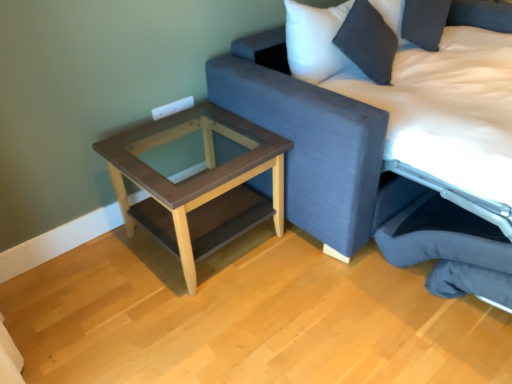
Question: Considering the relative positions of textured fabric studio couch at upper right and dark gray fabric swivel chair at lower right in the image provided, is textured fabric studio couch at upper right to the right of dark gray fabric swivel chair at lower right from the viewer's perspective?

Choices:
 (A) yes
 (B) no

Answer: (A)

Question: Is textured fabric studio couch at upper right oriented away from dark gray fabric swivel chair at lower right?

Choices:
 (A) yes
 (B) no

Answer: (B)

Question: Is textured fabric studio couch at upper right in front of dark gray fabric swivel chair at lower right?

Choices:
 (A) yes
 (B) no

Answer: (A)

Question: From the image's perspective, does textured fabric studio couch at upper right appear higher than dark gray fabric swivel chair at lower right?

Choices:
 (A) no
 (B) yes

Answer: (B)

Question: Is there a large distance between textured fabric studio couch at upper right and dark gray fabric swivel chair at lower right?

Choices:
 (A) yes
 (B) no

Answer: (B)

Question: From their relative heights in the image, would you say dark gray fabric swivel chair at lower right is taller or shorter than textured fabric studio couch at upper right?

Choices:
 (A) tall
 (B) short

Answer: (B)

Question: Relative to textured fabric studio couch at upper right, is dark gray fabric swivel chair at lower right in front or behind?

Choices:
 (A) behind
 (B) front

Answer: (A)

Question: Would you say dark gray fabric swivel chair at lower right is to the left or to the right of textured fabric studio couch at upper right in the picture?

Choices:
 (A) right
 (B) left

Answer: (B)

Question: Would you say dark gray fabric swivel chair at lower right is inside or outside textured fabric studio couch at upper right?

Choices:
 (A) inside
 (B) outside

Answer: (A)

Question: In terms of width, does brown wood table at lower left look wider or thinner when compared to dark gray fabric swivel chair at lower right?

Choices:
 (A) thin
 (B) wide

Answer: (A)

Question: Is brown wood table at lower left in front of or behind dark gray fabric swivel chair at lower right in the image?

Choices:
 (A) behind
 (B) front

Answer: (A)

Question: Does point (246, 175) appear closer or farther from the camera than point (439, 284)?

Choices:
 (A) closer
 (B) farther

Answer: (A)

Question: Is brown wood table at lower left taller or shorter than dark gray fabric swivel chair at lower right?

Choices:
 (A) tall
 (B) short

Answer: (A)

Question: Is textured fabric studio couch at upper right taller or shorter than brown wood table at lower left?

Choices:
 (A) short
 (B) tall

Answer: (B)

Question: Considering the positions of point (271, 44) and point (194, 289), is point (271, 44) closer or farther from the camera than point (194, 289)?

Choices:
 (A) closer
 (B) farther

Answer: (B)